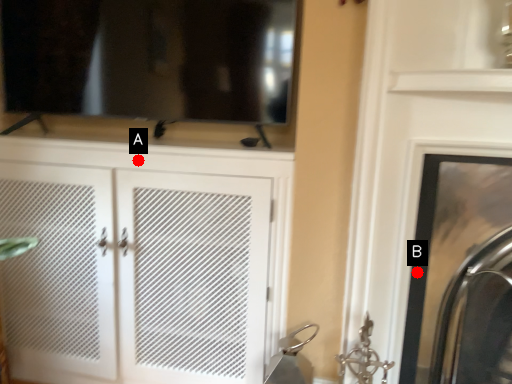
Question: Two points are circled on the image, labeled by A and B beside each circle. Which point is further to the camera?

Choices:
 (A) A is further
 (B) B is further

Answer: (A)